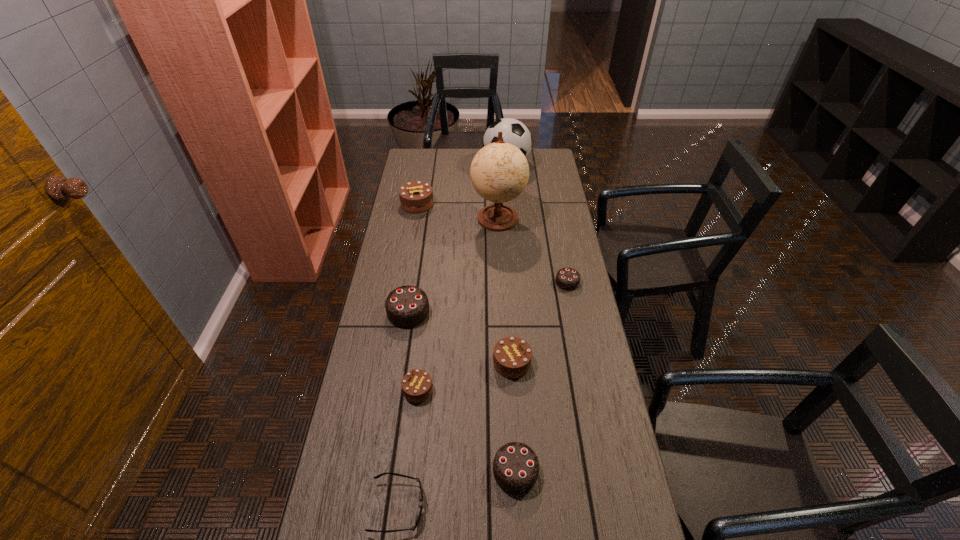
Locate an element on the screen. This screenshot has width=960, height=540. vacant point located between the second smallest chocolate chocolate cake and the shortest object is located at coordinates [x=457, y=489].

This screenshot has width=960, height=540. Identify the location of unoccupied area between the smallest brown chocolate cake and the second biggest brown chocolate cake. click(465, 376).

Identify the location of free space that is in between the second smallest brown chocolate cake and the beige globe. The width and height of the screenshot is (960, 540). (505, 291).

Identify the location of vacant area that lies between the third farthest chocolate cake and the fifth nearest chocolate cake. This screenshot has width=960, height=540. (488, 297).

Select which object is the fifth closest to the black sunglasses. Please provide its 2D coordinates. Your answer should be formatted as a tuple, i.e. [(x, y)], where the tuple contains the x and y coordinates of a point satisfying the conditions above.

[(568, 279)]

Find the location of a particular element. The width and height of the screenshot is (960, 540). object that is the sixth closest to the second biggest brown chocolate cake is located at coordinates (499, 172).

Find the location of `chocolate cake that can be found as the third closest to the black sunglasses`. chocolate cake that can be found as the third closest to the black sunglasses is located at coordinates (512, 356).

Identify the location of chocolate cake that stands as the fifth closest to the black sunglasses. This screenshot has height=540, width=960. (568, 279).

Where is `brown chocolate cake that is the closest to the shortest object`? The height and width of the screenshot is (540, 960). brown chocolate cake that is the closest to the shortest object is located at coordinates (416, 385).

The height and width of the screenshot is (540, 960). I want to click on brown chocolate cake object that ranks as the closest to the second chocolate chocolate cake from left to right, so click(x=512, y=356).